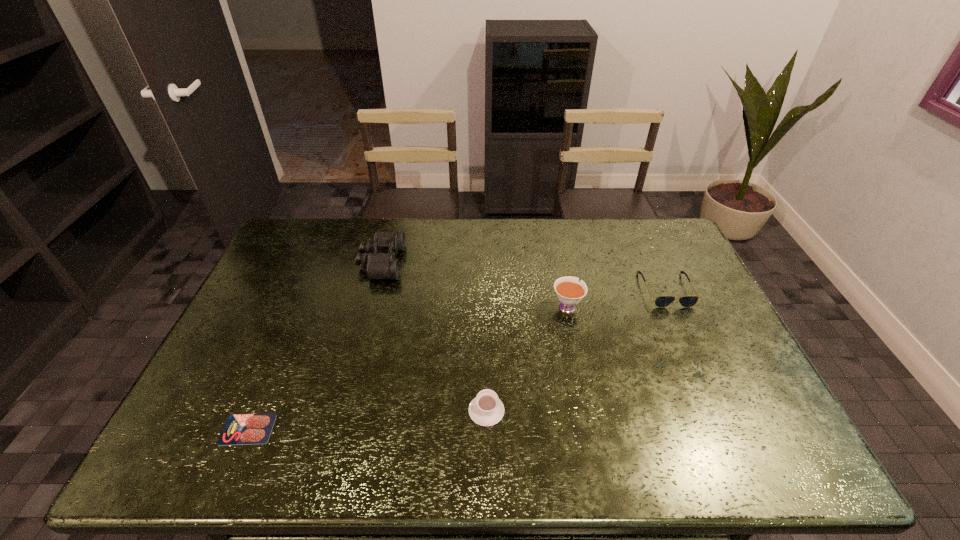
Identify the location of vacant space located 0.320m on the side of the taller teacup with the handle. The height and width of the screenshot is (540, 960). (552, 233).

This screenshot has width=960, height=540. In order to click on free location located on the side of the taller teacup with the handle in this screenshot , I will do `click(550, 221)`.

I want to click on free region located on the front-facing side of the sunglasses, so click(x=718, y=403).

You are a GUI agent. You are given a task and a screenshot of the screen. Output one action in this format:
    pyautogui.click(x=<x>, y=<y>)
    Task: Click on the free space located on the handle side of the nearer teacup
    The width and height of the screenshot is (960, 540).
    Given the screenshot: What is the action you would take?
    pyautogui.click(x=486, y=346)

Where is `free spot located 0.260m on the handle side of the nearer teacup`? free spot located 0.260m on the handle side of the nearer teacup is located at coordinates (486, 319).

I want to click on vacant space located 0.390m on the handle side of the nearer teacup, so click(x=485, y=289).

I want to click on blank space located 0.290m on the right of the shortest object, so click(396, 429).

You are a GUI agent. You are given a task and a screenshot of the screen. Output one action in this format:
    pyautogui.click(x=<x>, y=<y>)
    Task: Click on the object located at the far edge
    Image resolution: width=960 pixels, height=540 pixels.
    Given the screenshot: What is the action you would take?
    pyautogui.click(x=381, y=263)

Where is `object that is positioned at the near edge`? object that is positioned at the near edge is located at coordinates (241, 429).

Where is `object located at the left edge`? The width and height of the screenshot is (960, 540). object located at the left edge is located at coordinates coord(241,429).